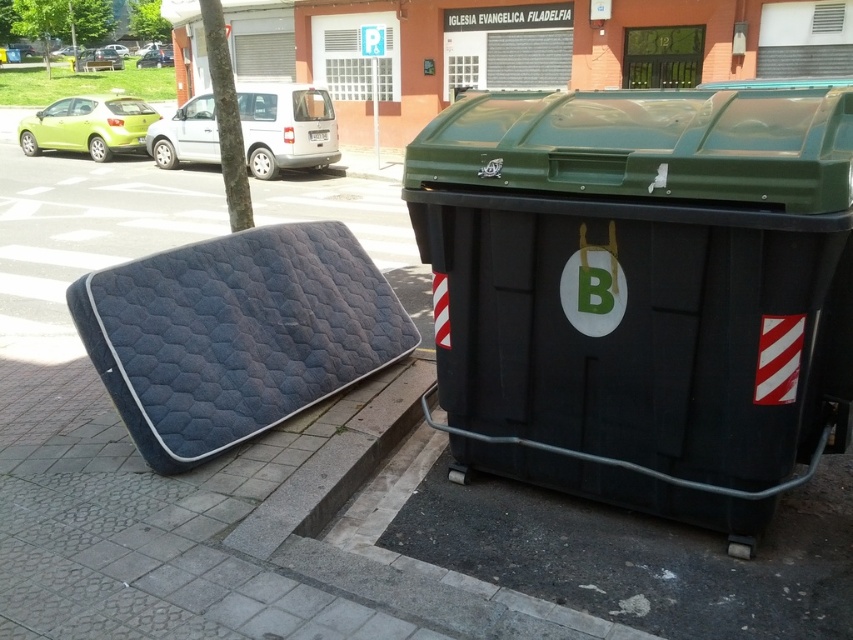
Question: Is matte green car at upper left to the right of metallic silver car at upper left from the viewer's perspective?

Choices:
 (A) no
 (B) yes

Answer: (B)

Question: Does black plastic recycling bin at center have a larger size compared to dark blue quilted mattress at lower left?

Choices:
 (A) no
 (B) yes

Answer: (B)

Question: Which point appears closest to the camera in this image?

Choices:
 (A) (200, 124)
 (B) (321, 321)

Answer: (B)

Question: Can you confirm if matte green car at upper left is thinner than metallic silver car at upper left?

Choices:
 (A) no
 (B) yes

Answer: (A)

Question: Which of the following is the farthest from the observer?

Choices:
 (A) [155, 140]
 (B) [74, 68]
 (C) [317, 257]

Answer: (B)

Question: Which is farther from the metallic silver car at upper left?

Choices:
 (A) dark blue quilted mattress at lower left
 (B) black plastic recycling bin at center

Answer: (B)